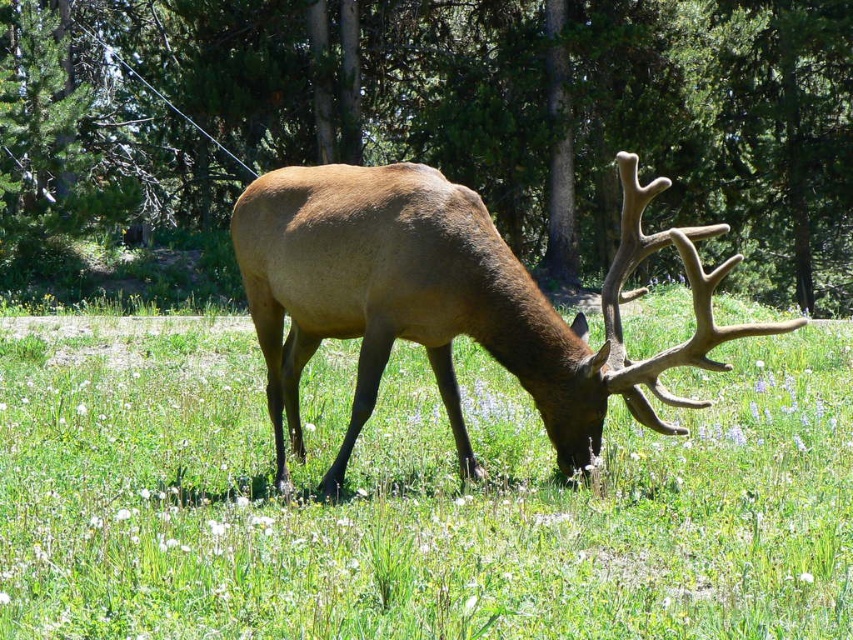
Between green grass at center and brown velvet deer at center, which one appears on the right side from the viewer's perspective?

Positioned to the right is brown velvet deer at center.

Is green grass at center above brown velvet deer at center?

No.

Find the location of a particular element. This screenshot has height=640, width=853. green grass at center is located at coordinates (410, 499).

Does point (773, 156) lie behind point (311, 294)?

Yes, it is behind point (311, 294).

Which is behind, point (770, 246) or point (746, 333)?

The point (770, 246) is behind.

Between point (96, 289) and point (287, 227), which one is positioned in front?

Point (287, 227)

I want to click on brown matte tree at center, so click(428, 125).

How distant is green grass at center from brown matte tree at center?

green grass at center is 16.15 meters away from brown matte tree at center.

Can you confirm if green grass at center is thinner than brown matte tree at center?

Indeed, green grass at center has a lesser width compared to brown matte tree at center.

Which is behind, point (74, 388) or point (515, 202)?

Point (515, 202)

Locate an element on the screen. green grass at center is located at coordinates (410, 499).